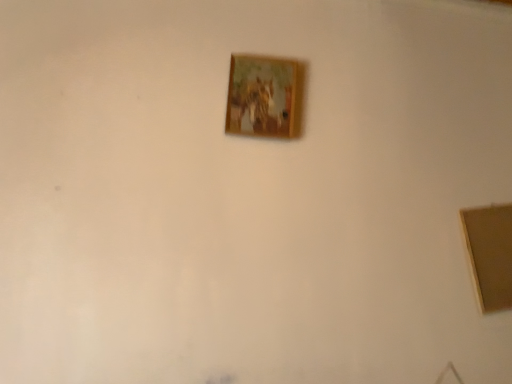
Question: Is point (291, 137) positioned closer to the camera than point (480, 302)?

Choices:
 (A) farther
 (B) closer

Answer: (A)

Question: Based on their positions, is wooden frame at center, which appears as the second picture frame when ordered from the bottom, located to the left or right of wooden picture frame at upper center, which appears as the 1th picture frame when viewed from the right?

Choices:
 (A) left
 (B) right

Answer: (A)

Question: From the image's perspective, is wooden frame at center, the first picture frame viewed from the top, located above or below wooden picture frame at upper center, placed as the 2th picture frame when sorted from left to right?

Choices:
 (A) above
 (B) below

Answer: (A)

Question: From a real-world perspective, relative to wooden frame at center, the 1th picture frame positioned from the left, is wooden picture frame at upper center, placed as the 2th picture frame when sorted from left to right, vertically above or below?

Choices:
 (A) below
 (B) above

Answer: (A)

Question: Considering the positions of point (503, 251) and point (261, 71), is point (503, 251) closer or farther from the camera than point (261, 71)?

Choices:
 (A) farther
 (B) closer

Answer: (A)

Question: In terms of width, does wooden picture frame at upper center, marked as the 2th picture frame in a top-to-bottom arrangement, look wider or thinner when compared to wooden frame at center, which appears as the second picture frame when ordered from the bottom?

Choices:
 (A) thin
 (B) wide

Answer: (B)

Question: From the image's perspective, is wooden picture frame at upper center, which appears as the 1th picture frame when viewed from the right, located above or below wooden frame at center, the 1th picture frame positioned from the left?

Choices:
 (A) above
 (B) below

Answer: (B)